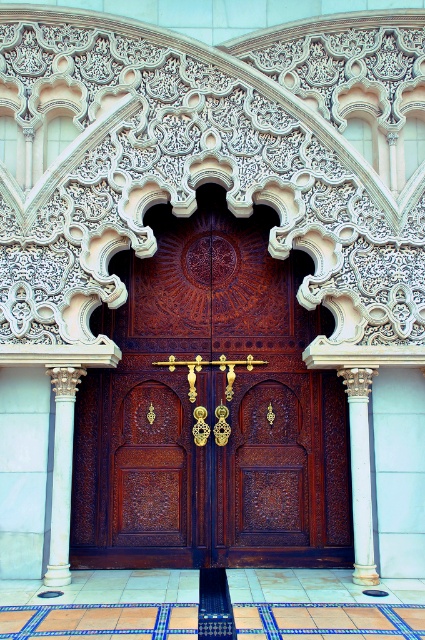
Between polished wood door at center and white marble column at left, which one has less height?

With less height is white marble column at left.

Which is in front, point (232, 278) or point (56, 556)?

Positioned in front is point (56, 556).

The width and height of the screenshot is (425, 640). I want to click on polished wood door at center, so pyautogui.click(x=212, y=410).

Who is taller, polished wood door at center or white marble column at center?

polished wood door at center is taller.

Between polished wood door at center and white marble column at center, which one appears on the right side from the viewer's perspective?

Positioned to the right is white marble column at center.

What do you see at coordinates (212, 410) in the screenshot? I see `polished wood door at center` at bounding box center [212, 410].

Find the location of `polished wood door at center`. polished wood door at center is located at coordinates (212, 410).

Measure the distance between white marble column at left and white marble column at center.

white marble column at left and white marble column at center are 8.27 meters apart.

Does white marble column at left have a lesser width compared to white marble column at center?

No.

Measure the distance between point (45, 572) and camera.

22.59 meters

What are the coordinates of `white marble column at left` in the screenshot? It's located at (62, 472).